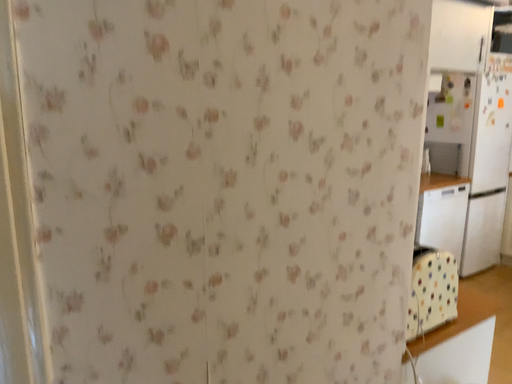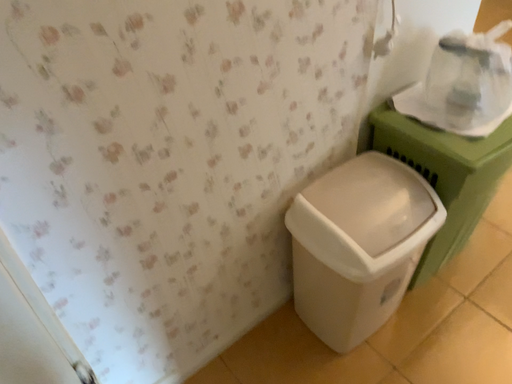
Question: Which way did the camera rotate in the video?

Choices:
 (A) rotated upward
 (B) rotated downward

Answer: (B)